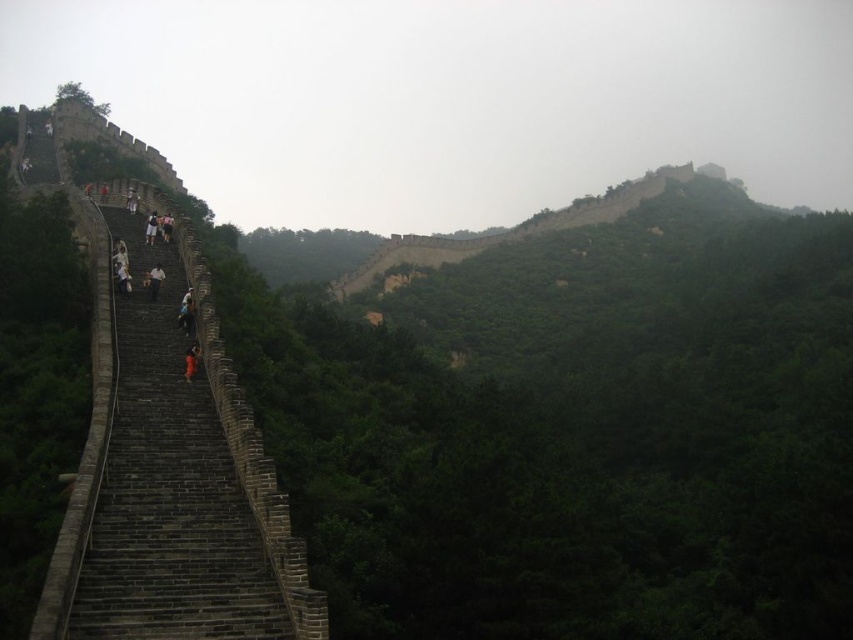
Based on the photo, you are standing at the center of the image and want to reach the dark gray stone stairs at left. In which direction should you move?

You should move to the left to reach the dark gray stone stairs at left since it is located at point 0.748 on the x axis, which is to the left of the center point at 0.5.

You are standing on the dark gray stone stairs at left and want to see the orange fabric person at left. In which direction should you look to see them?

The dark gray stone stairs at left is in front of the orange fabric person at left, so you should look behind you to see the orange fabric person at left.